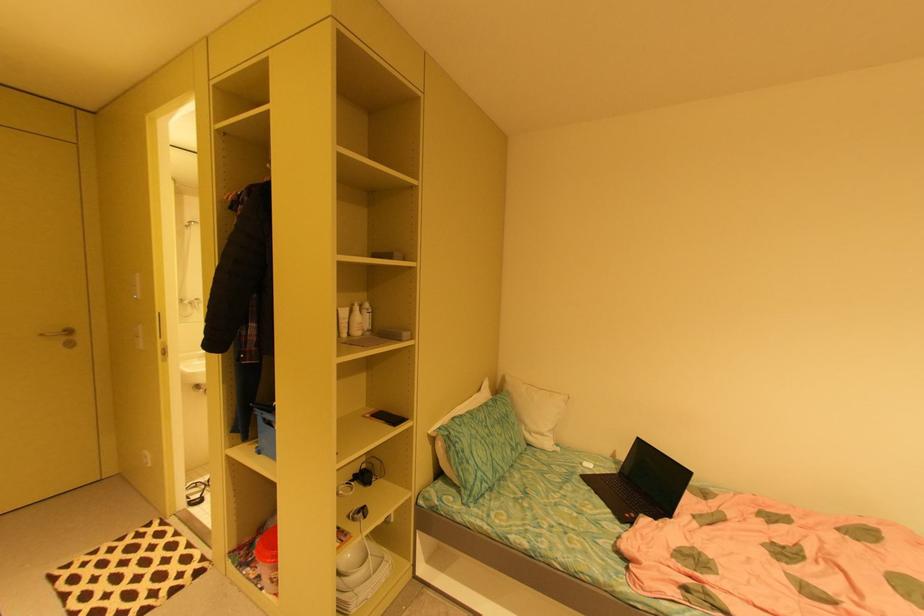
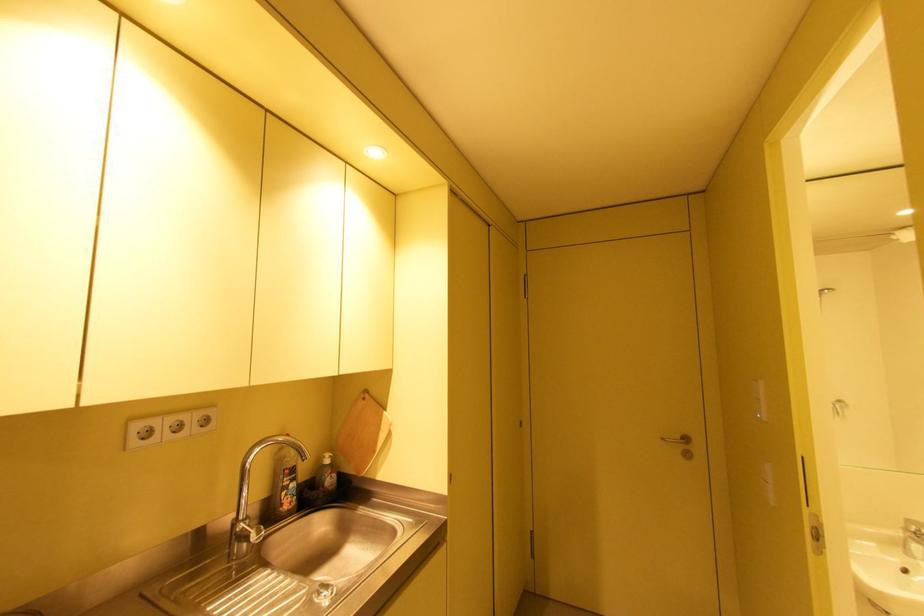
Question: The camera is either moving clockwise (left) or counter-clockwise (right) around the object. The first image is from the beginning of the video and the second image is from the end. Is the camera moving left or right when shooting the video?

Choices:
 (A) Left
 (B) Right

Answer: (B)